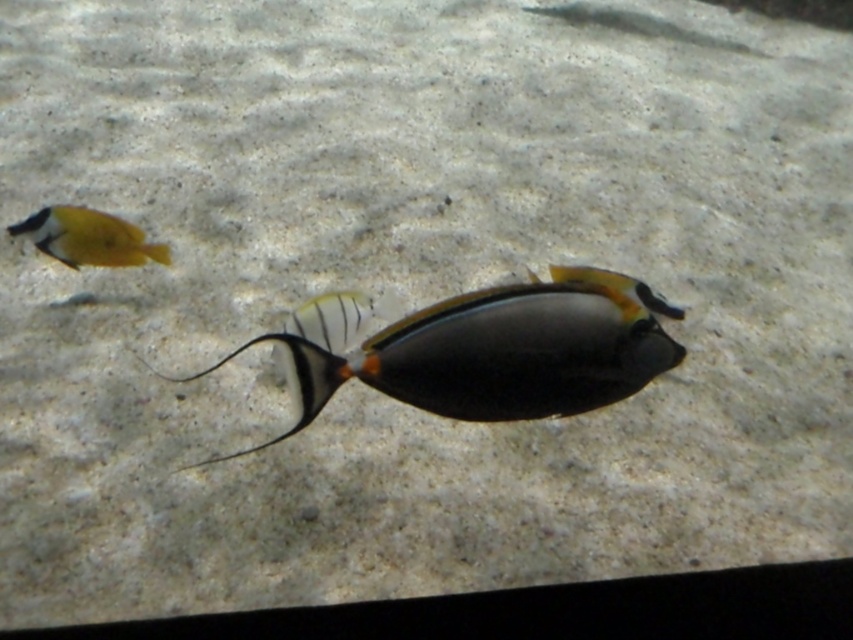
Question: Where is shiny black fish at center located in relation to yellow matte fish at upper left in the image?

Choices:
 (A) right
 (B) left

Answer: (A)

Question: Can you confirm if shiny black fish at center is positioned to the left of yellow matte fish at upper left?

Choices:
 (A) yes
 (B) no

Answer: (B)

Question: Which point is closer to the camera taking this photo?

Choices:
 (A) (65, 214)
 (B) (654, 298)

Answer: (A)

Question: Considering the relative positions of shiny black fish at center and yellow matte fish at upper left in the image provided, where is shiny black fish at center located with respect to yellow matte fish at upper left?

Choices:
 (A) right
 (B) left

Answer: (A)

Question: Which object appears farthest from the camera in this image?

Choices:
 (A) shiny black fish at center
 (B) yellow matte fish at upper left

Answer: (B)